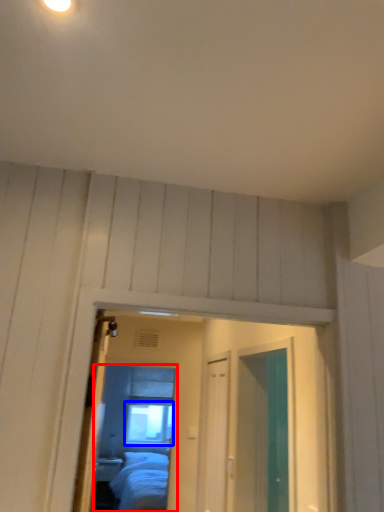
Question: Among these objects, which one is nearest to the camera, mirror (highlighted by a red box) or window (highlighted by a blue box)?

Choices:
 (A) mirror
 (B) window

Answer: (A)